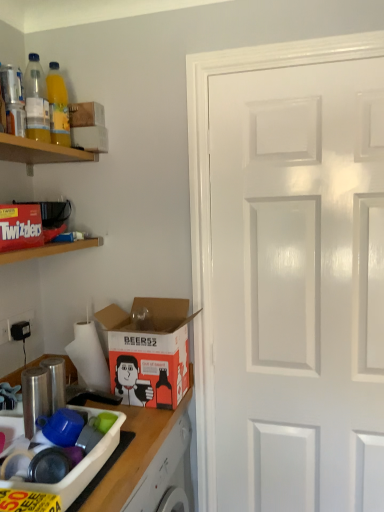
Question: From a real-world perspective, is red matte twizzlers box at upper left, marked as the second shelf in a top-to-bottom arrangement, above or below white matte toilet paper at lower left?

Choices:
 (A) below
 (B) above

Answer: (B)

Question: Considering the relative positions of red matte twizzlers box at upper left, arranged as the first shelf when ordered from the bottom, and white matte toilet paper at lower left in the image provided, is red matte twizzlers box at upper left, arranged as the first shelf when ordered from the bottom, to the left or to the right of white matte toilet paper at lower left?

Choices:
 (A) right
 (B) left

Answer: (B)

Question: Based on their relative distances, which object is farther from the matte cardboard box at lower left, which is the first box from front to back?

Choices:
 (A) red matte twizzlers box at upper left, arranged as the first shelf when ordered from the bottom
 (B) white matte toilet paper at lower left
 (C) white glossy door at right
 (D) white cardboard box at upper left, which appears as the first box when viewed from the top
 (E) translucent plastic bottle at upper left, positioned as the first bottle in front-to-back order

Answer: (D)

Question: Estimate the real-world distances between objects in this image. Which object is closer to the white matte toilet paper at lower left?

Choices:
 (A) white cardboard box at upper left, which appears as the first box when viewed from the top
 (B) translucent plastic bottle at upper left, positioned as the first bottle in front-to-back order
 (C) translucent plastic bottle at upper left, marked as the 2th bottle in a front-to-back arrangement
 (D) white glossy door at right
 (E) matte red twizzlers box at upper left, marked as the second box in a top-to-bottom arrangement

Answer: (E)